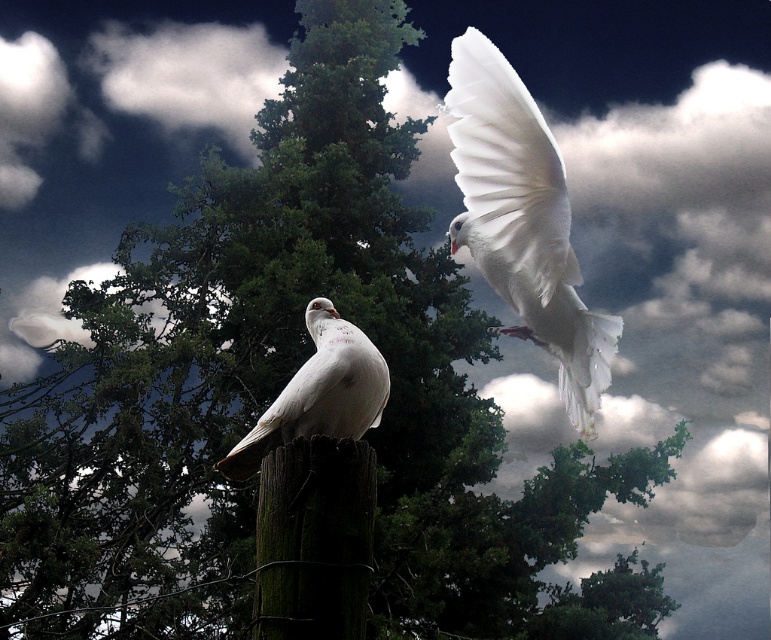
You are a birdwatcher observing the scene. You notice the white feathered dove at upper right and the green mossy wood at center. Which object is located above the other?

The white feathered dove at upper right is positioned over green mossy wood at center, meaning it is above the green mossy wood at center.